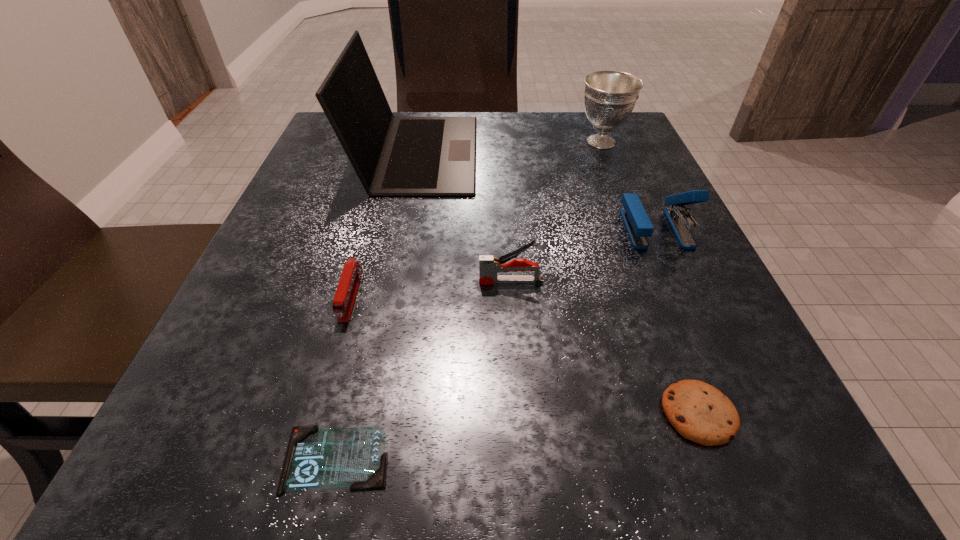
I want to click on cookie that is at the near edge, so click(x=699, y=412).

Locate an element on the screen. Image resolution: width=960 pixels, height=540 pixels. identity card that is at the near edge is located at coordinates (316, 458).

Identify the location of laptop present at the left edge. (393, 156).

What are the coordinates of `stapler that is positioned at the left edge` in the screenshot? It's located at (346, 293).

At what (x,y) coordinates should I click in order to perform the action: click on identity card located in the left edge section of the desktop. Please return your answer as a coordinate pair (x, y). The width and height of the screenshot is (960, 540). Looking at the image, I should click on (316, 458).

Where is `chalice present at the right edge`? The height and width of the screenshot is (540, 960). chalice present at the right edge is located at coordinates (610, 96).

Identify the location of stapler situated at the right edge. (638, 225).

I want to click on cookie that is at the right edge, so click(699, 412).

This screenshot has width=960, height=540. I want to click on object that is positioned at the far left corner, so click(393, 156).

Locate an element on the screen. The width and height of the screenshot is (960, 540). object located in the near left corner section of the desktop is located at coordinates (316, 458).